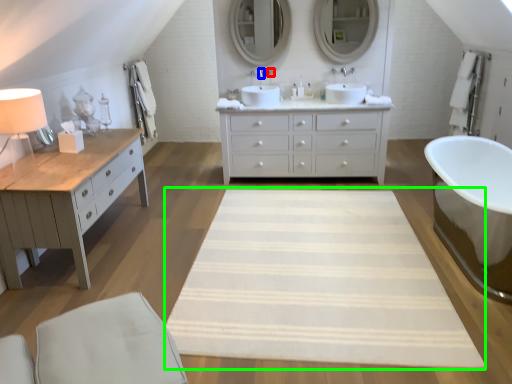
Question: Which is farther away from faucet (highlighted by a red box)? faucet (highlighted by a blue box) or mat (highlighted by a green box)?

Choices:
 (A) faucet
 (B) mat

Answer: (B)